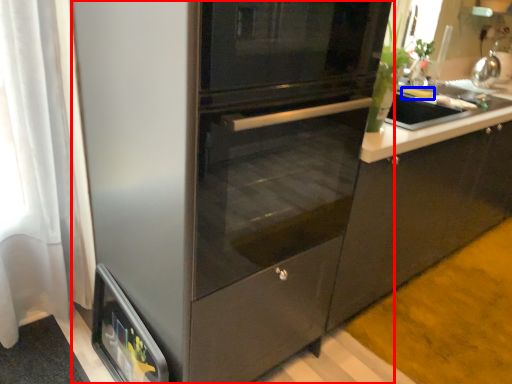
Question: Which object appears farthest to the camera in this image, fridge (highlighted by a red box) or food (highlighted by a blue box)?

Choices:
 (A) fridge
 (B) food

Answer: (B)